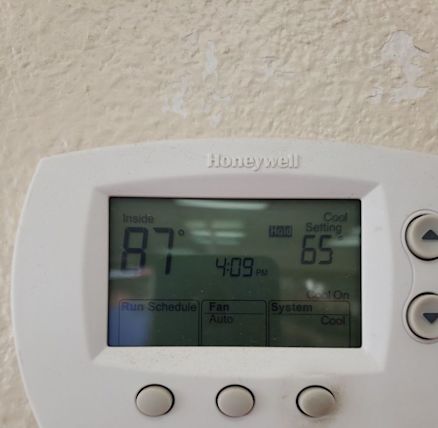
Where is `thermometer plastic housing`? The width and height of the screenshot is (438, 428). thermometer plastic housing is located at coordinates (50, 301).